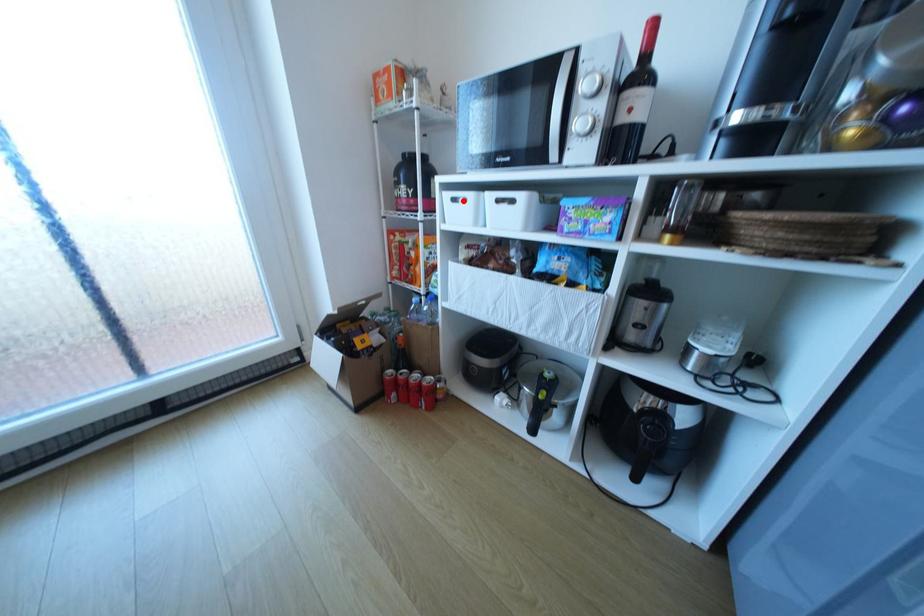
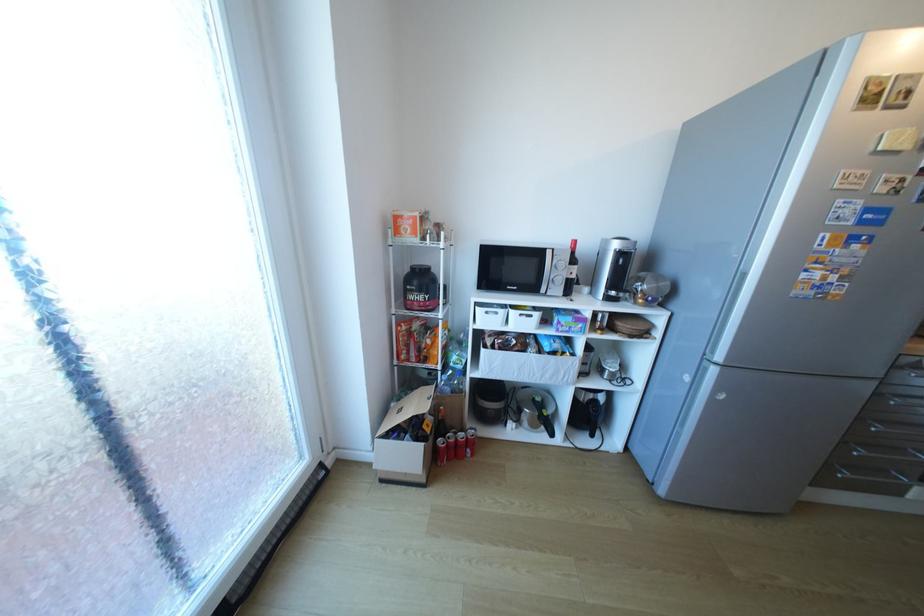
Question: A red point is marked in image1. In image2, is the corresponding 3D point closer to the camera or farther? Reply with the corresponding letter.

Choices:
 (A) The corresponding 3D point is closer.
 (B) The corresponding 3D point is farther.

Answer: (B)